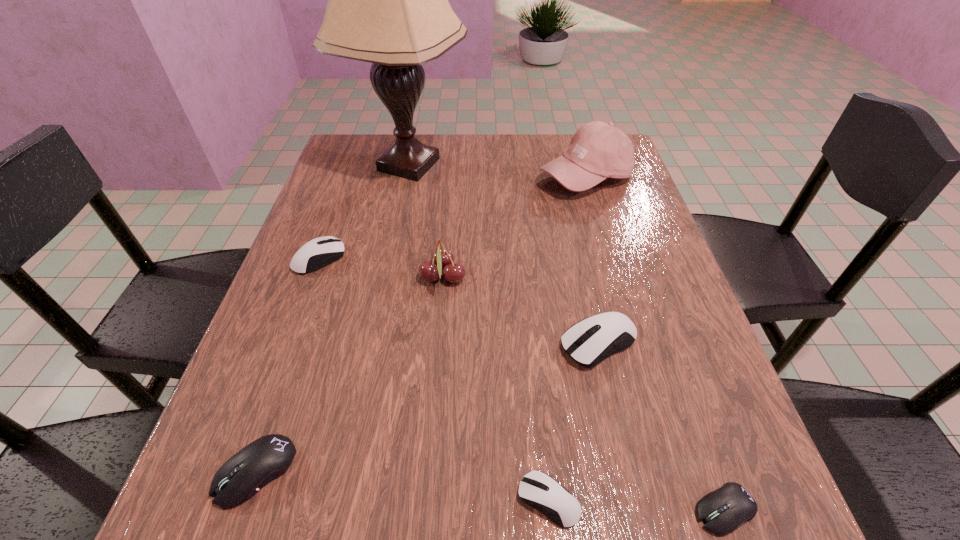
The height and width of the screenshot is (540, 960). What are the coordinates of `vacant point located between the bigger black computer equipment and the smaller black computer equipment` in the screenshot? It's located at (491, 490).

Find the location of a particular element. The height and width of the screenshot is (540, 960). free space between the rightmost computer equipment and the bigger black computer equipment is located at coordinates (491, 490).

Locate an element on the screen. This screenshot has height=540, width=960. free spot between the rightmost computer equipment and the left black computer equipment is located at coordinates [x=491, y=490].

You are a GUI agent. You are given a task and a screenshot of the screen. Output one action in this format:
    pyautogui.click(x=<x>, y=<y>)
    Task: Click on the free space between the fourth computer equipment from left to right and the second smallest white mouse
    
    Given the screenshot: What is the action you would take?
    pyautogui.click(x=459, y=301)

You are a GUI agent. You are given a task and a screenshot of the screen. Output one action in this format:
    pyautogui.click(x=<x>, y=<y>)
    Task: Click on the empty location between the second smallest white mouse and the tallest computer equipment
    
    Given the screenshot: What is the action you would take?
    pyautogui.click(x=459, y=301)

Where is `free space between the farthest white mouse and the tallest computer equipment`? free space between the farthest white mouse and the tallest computer equipment is located at coordinates (459, 301).

You are a GUI agent. You are given a task and a screenshot of the screen. Output one action in this format:
    pyautogui.click(x=<x>, y=<y>)
    Task: Click on the object that stands as the fifth closest to the nearest white mouse
    The height and width of the screenshot is (540, 960).
    Given the screenshot: What is the action you would take?
    (x=319, y=252)

Find the location of `object that can be found as the seventh closest to the cherry`. object that can be found as the seventh closest to the cherry is located at coordinates (723, 510).

Locate an element on the screen. The width and height of the screenshot is (960, 540). computer equipment that is the third closest to the third computer equipment from right to left is located at coordinates (262, 461).

Where is `the third closest computer equipment to the smaller black computer equipment`? Image resolution: width=960 pixels, height=540 pixels. the third closest computer equipment to the smaller black computer equipment is located at coordinates (x=262, y=461).